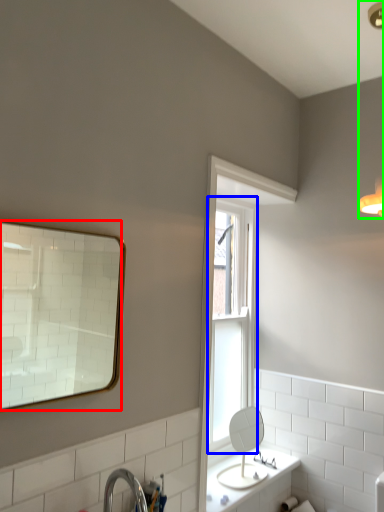
Question: Estimate the real-world distances between objects in this image. Which object is farther from mirror (highlighted by a red box), window (highlighted by a blue box) or light fixture (highlighted by a green box)?

Choices:
 (A) window
 (B) light fixture

Answer: (B)